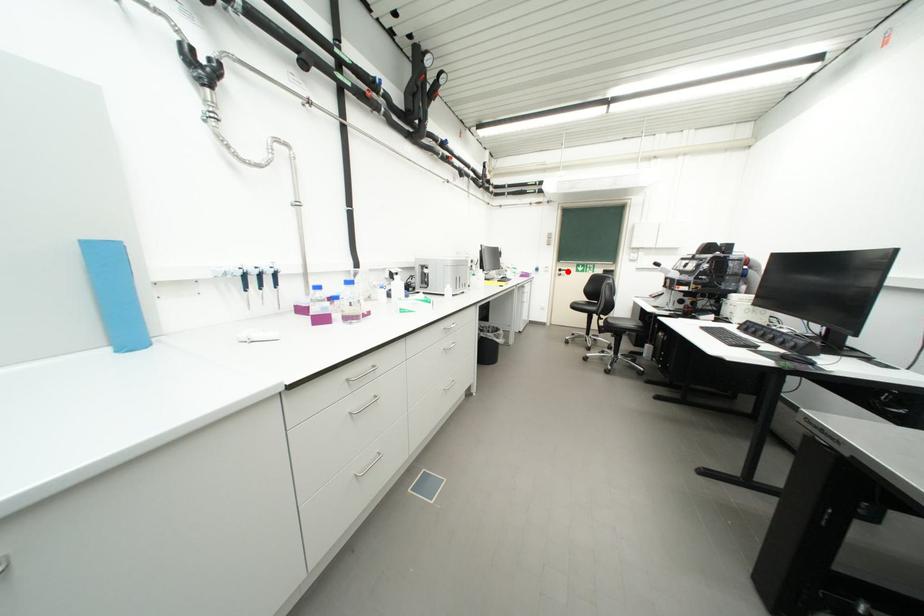
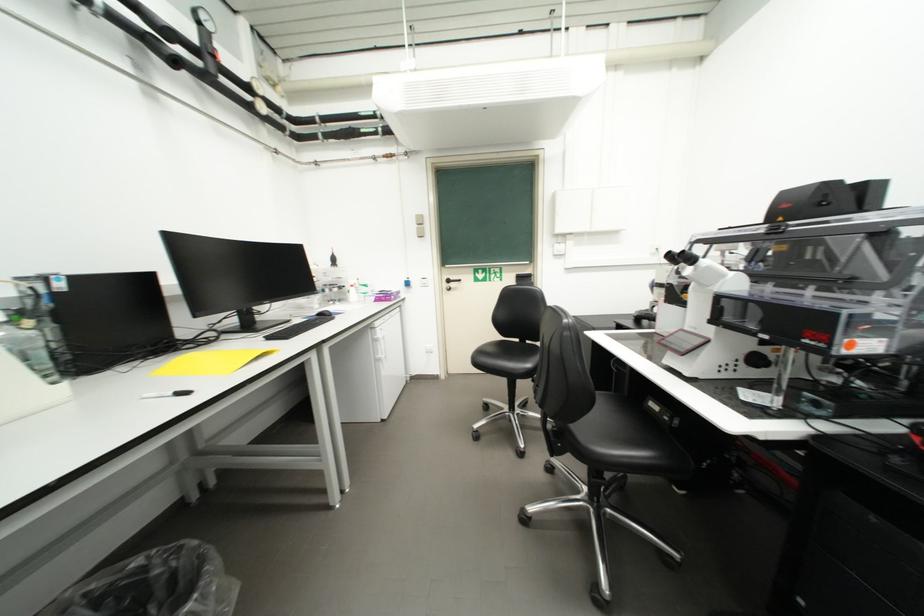
In the second image, find the point that corresponds to the highlighted location in the first image.

(456, 283)